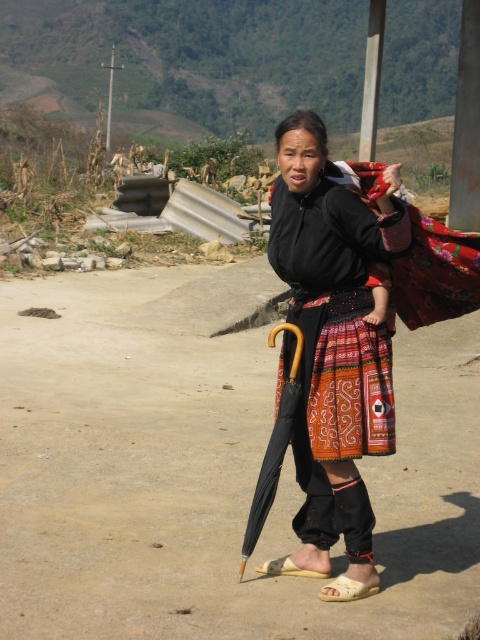
Which is above, black fabric umbrella at lower center or beige fabric sandal at lower center?

black fabric umbrella at lower center is above.

In order to click on black fabric umbrella at lower center in this screenshot , I will do `click(274, 448)`.

Is point (347, 580) closer to camera compared to point (326, 577)?

Yes, point (347, 580) is closer to viewer.

Is beige fabric sandal at lower center smaller than light brown leather sandal at lower center?

No.

Does point (340, 579) come in front of point (272, 568)?

That is True.

Find the location of a particular element. beige fabric sandal at lower center is located at coordinates (347, 589).

Which is below, black fabric umbrella at lower center or light brown leather sandal at lower center?

light brown leather sandal at lower center is below.

Does black fabric umbrella at lower center appear over light brown leather sandal at lower center?

Indeed, black fabric umbrella at lower center is positioned over light brown leather sandal at lower center.

Image resolution: width=480 pixels, height=640 pixels. In order to click on black fabric umbrella at lower center in this screenshot , I will do `click(274, 448)`.